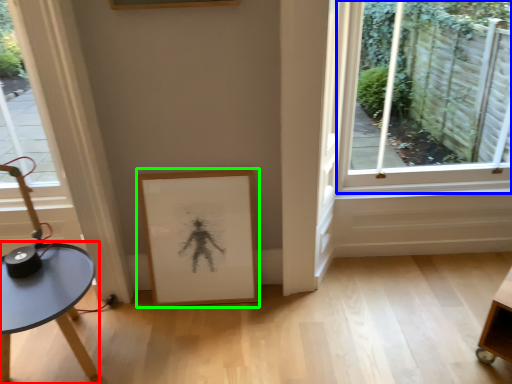
Question: Which is nearer to the table (highlighted by a red box)? window (highlighted by a blue box) or picture frame (highlighted by a green box).

Choices:
 (A) window
 (B) picture frame

Answer: (B)